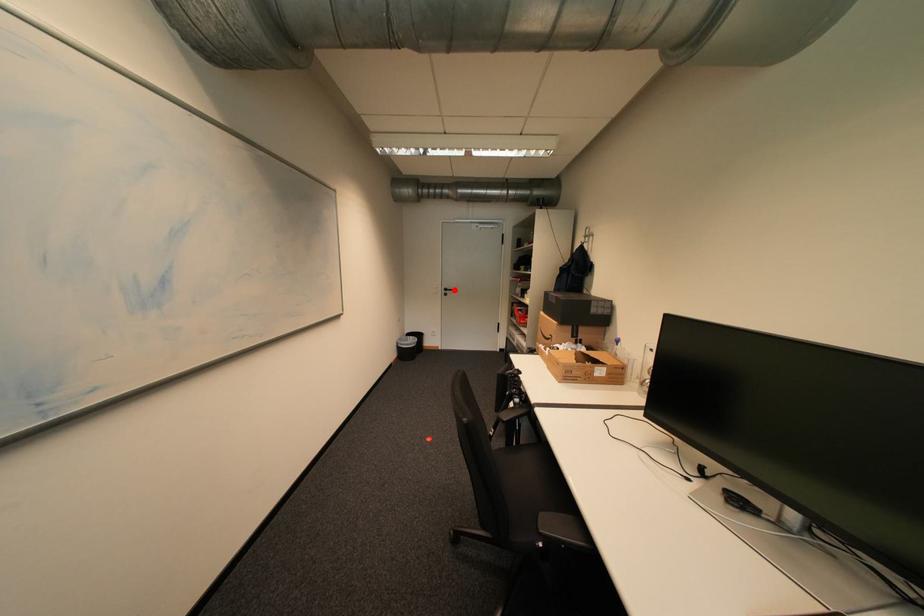
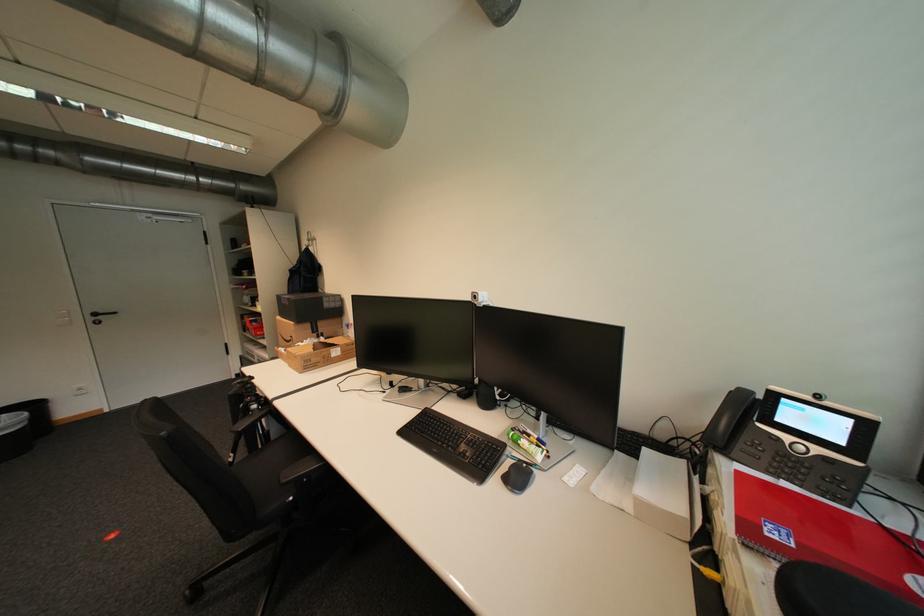
The point at the highlighted location is marked in the first image. Where is the corresponding point in the second image?

(103, 315)